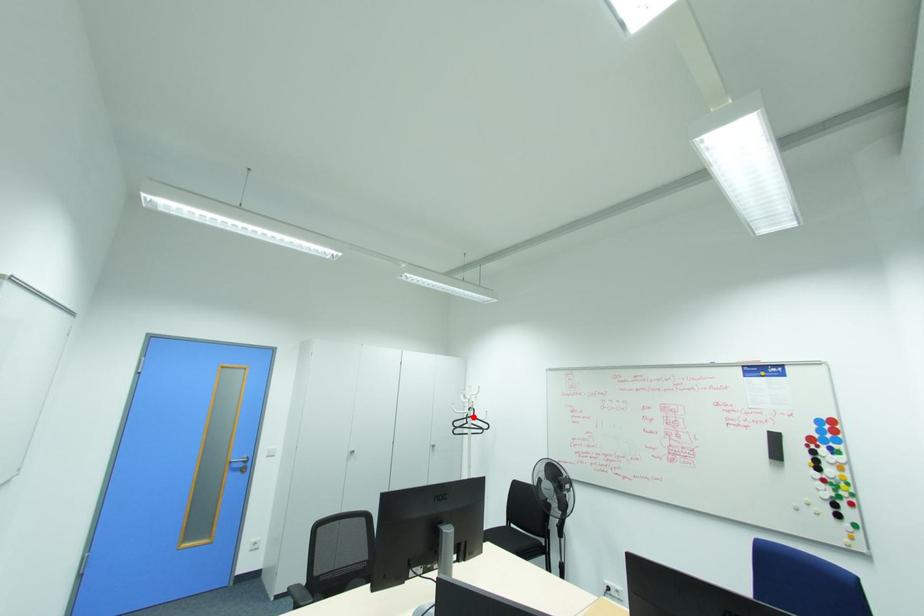
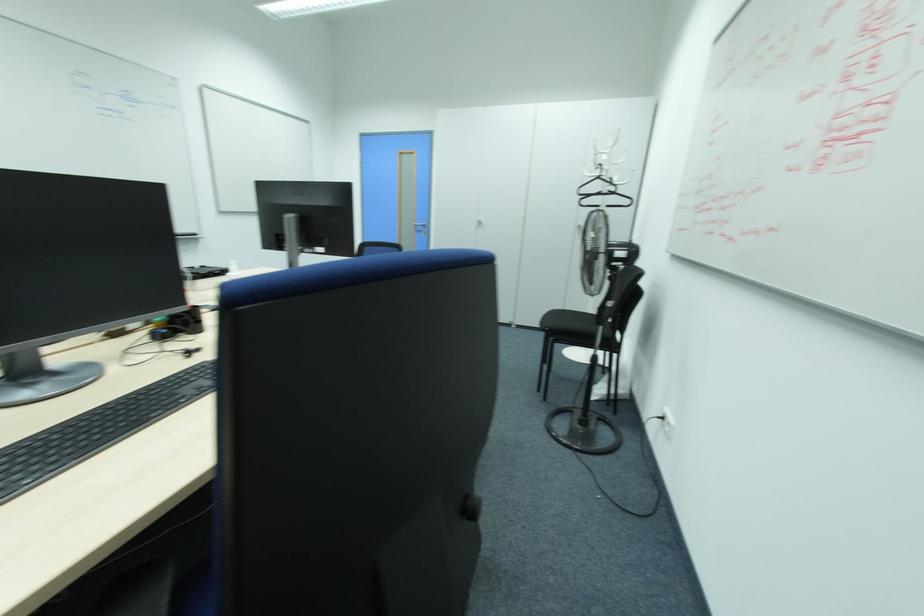
Locate, in the second image, the point that corresponds to the highlighted location in the first image.

(599, 177)